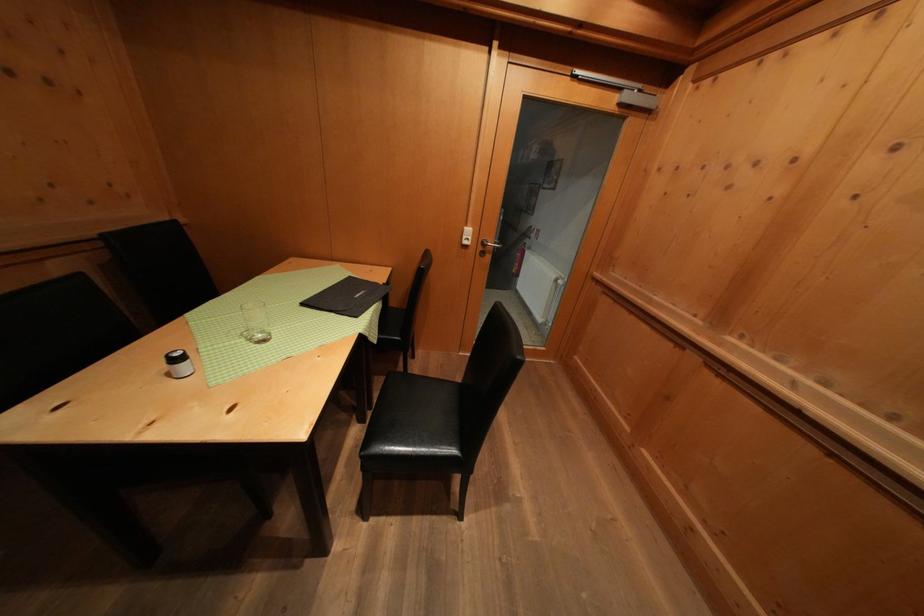
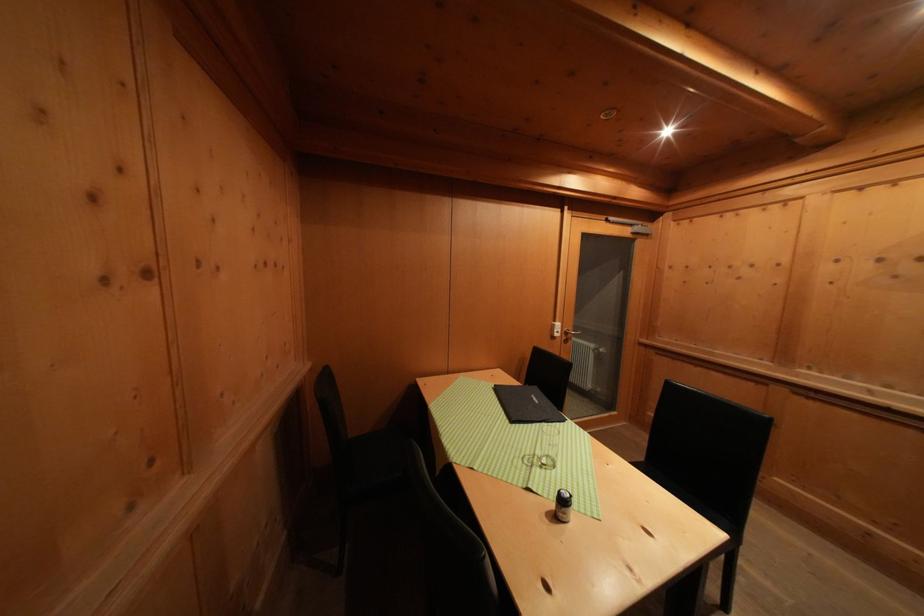
Where in the second image is the point corresponding to [475,235] from the first image?

(564, 330)